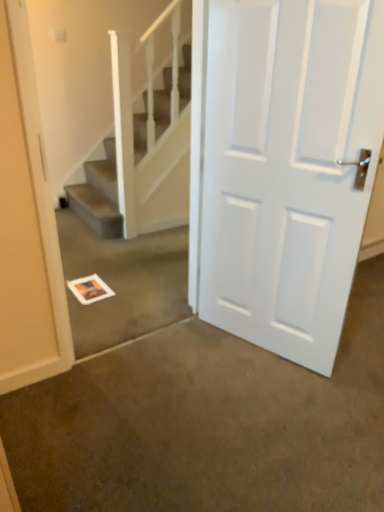
This screenshot has width=384, height=512. What do you see at coordinates (99, 195) in the screenshot?
I see `white textured stairs at upper center` at bounding box center [99, 195].

The height and width of the screenshot is (512, 384). What are the coordinates of `white matte door at center` in the screenshot? It's located at (286, 166).

I want to click on white paper at center, so click(90, 289).

Looking at this image, would you say white textured stairs at upper center contains white paper at center?

No, white paper at center is located outside of white textured stairs at upper center.

Would you say white textured stairs at upper center is to the left or to the right of white paper at center in the picture?

white textured stairs at upper center is positioned on white paper at center's right side.

Is white textured stairs at upper center looking in the opposite direction of white paper at center?

white textured stairs at upper center is not turned away from white paper at center.

Considering the sizes of white textured stairs at upper center and white paper at center in the image, is white textured stairs at upper center wider or thinner than white paper at center?

Clearly, white textured stairs at upper center has less width compared to white paper at center.

Between white paper at center and white matte door at center, which one appears on the right side from the viewer's perspective?

white matte door at center is more to the right.

Is white paper at center not within white matte door at center?

Yes, white paper at center is not within white matte door at center.

Considering the sizes of objects white paper at center and white matte door at center in the image provided, who is shorter, white paper at center or white matte door at center?

With less height is white paper at center.

How much distance is there between white paper at center and white matte door at center?

1.20 meters.

Find the location of a particular element. This screenshot has height=512, width=384. stairs above the white matte door at center (from the image's perspective) is located at coordinates (99, 195).

Measure the distance between white textured stairs at upper center and white matte door at center.

A: white textured stairs at upper center is 5.63 feet away from white matte door at center.

Between white textured stairs at upper center and white matte door at center, which one has smaller width?

Thinner between the two is white textured stairs at upper center.

Does white textured stairs at upper center lie in front of white matte door at center?

No, white textured stairs at upper center is further to the viewer.

Would you say white textured stairs at upper center is part of white paper at center's contents?

No, white textured stairs at upper center is located outside of white paper at center.

Who is bigger, white paper at center or white textured stairs at upper center?

With larger size is white textured stairs at upper center.

Considering the points (96, 298) and (137, 134), which point is behind, point (96, 298) or point (137, 134)?

The point (137, 134) is farther.

From a real-world perspective, is white matte door at center located higher than white textured stairs at upper center?

Indeed, from a real-world perspective, white matte door at center stands above white textured stairs at upper center.

Does white matte door at center have a greater width compared to white textured stairs at upper center?

Yes.

Could you tell me if white matte door at center is facing white paper at center?

No, white matte door at center is not turned towards white paper at center.

Based on the photo, does white matte door at center touch white paper at center?

No, white matte door at center is not with white paper at center.

Considering the sizes of objects white matte door at center and white paper at center in the image provided, who is bigger, white matte door at center or white paper at center?

white matte door at center.

I want to click on stairs above the white paper at center (from a real-world perspective), so click(x=99, y=195).

The height and width of the screenshot is (512, 384). Find the location of `postcard below the white matte door at center (from a real-world perspective)`. postcard below the white matte door at center (from a real-world perspective) is located at coordinates (90, 289).

When comparing their distances from white textured stairs at upper center, does white paper at center or white matte door at center seem closer?

Based on the image, white paper at center appears to be nearer to white textured stairs at upper center.

When comparing their distances from white paper at center, does white textured stairs at upper center or white matte door at center seem closer?

white textured stairs at upper center.

Estimate the real-world distances between objects in this image. Which object is further from white matte door at center, white textured stairs at upper center or white paper at center?

white textured stairs at upper center is positioned further to the anchor white matte door at center.

Based on their spatial positions, is white matte door at center or white paper at center further from white textured stairs at upper center?

The object further to white textured stairs at upper center is white matte door at center.

Which object lies nearer to the anchor point white paper at center, white matte door at center or white textured stairs at upper center?

white textured stairs at upper center.

Looking at this image, when comparing their distances from white matte door at center, does white paper at center or white textured stairs at upper center seem further?

Based on the image, white textured stairs at upper center appears to be further to white matte door at center.

The height and width of the screenshot is (512, 384). What are the coordinates of `postcard positioned between white matte door at center and white textured stairs at upper center from near to far` in the screenshot? It's located at (90, 289).